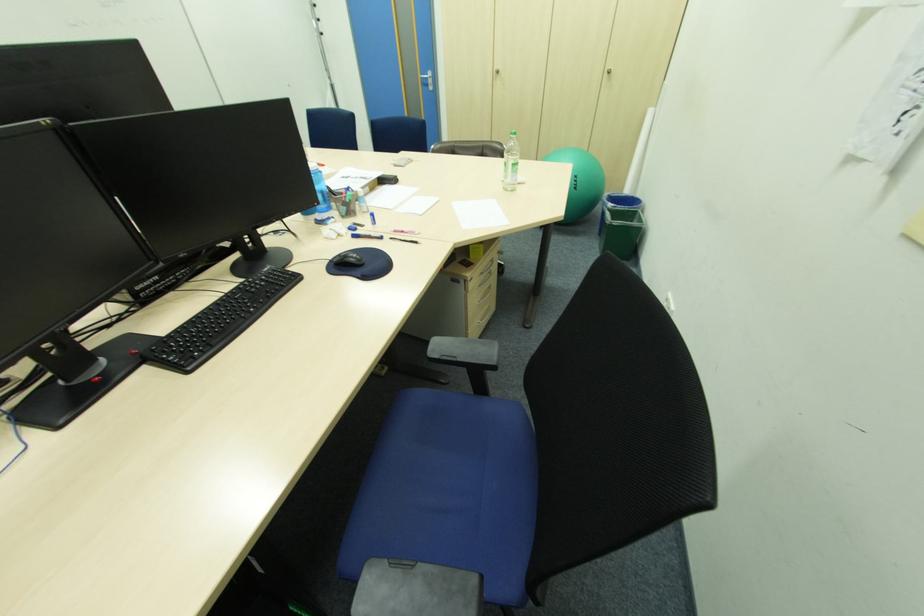
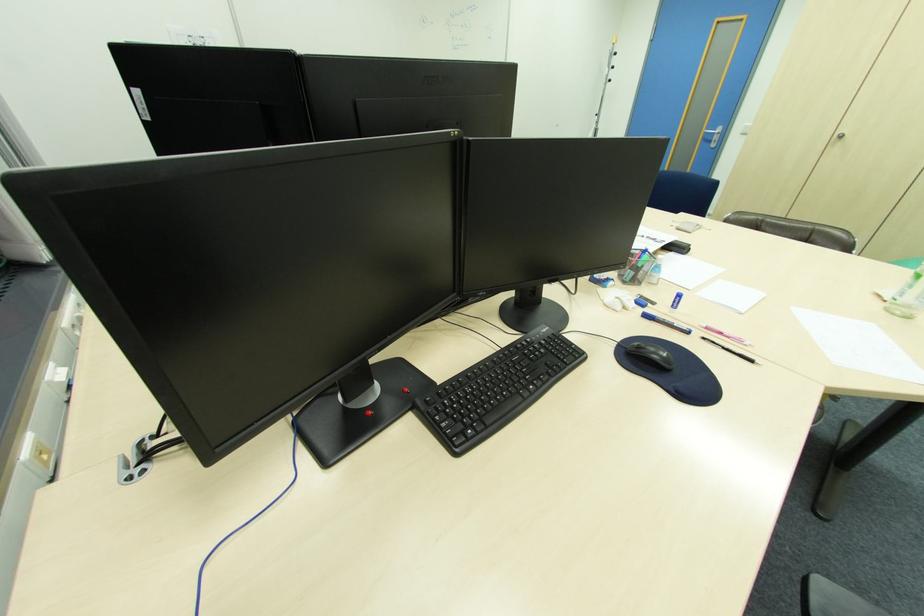
Where in the second image is the point corresponding to (432,84) from the first image?

(713, 139)